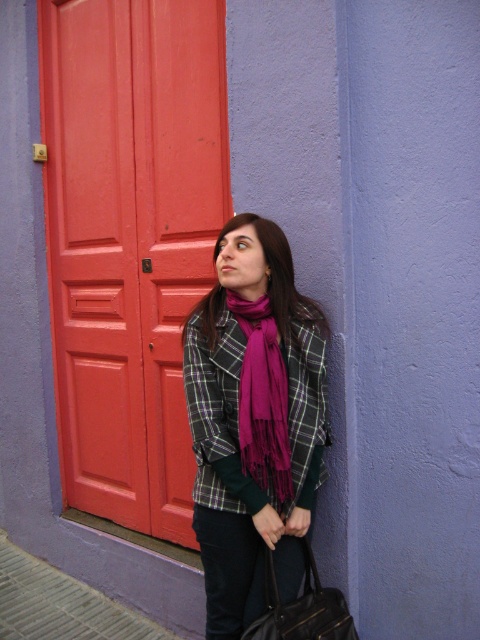
Question: Which object appears closest to the camera in this image?

Choices:
 (A) matte red door at left
 (B) plaid fabric at center

Answer: (B)

Question: Does purple fringed scarf at center have a lesser width compared to leather handbag at lower center?

Choices:
 (A) no
 (B) yes

Answer: (B)

Question: Which is nearer to the purple fringed scarf at center?

Choices:
 (A) leather handbag at lower center
 (B) matte red door at left
 (C) plaid woolen jacket at center
 (D) plaid fabric at center

Answer: (D)

Question: Is plaid woolen jacket at center behind purple fringed scarf at center?

Choices:
 (A) yes
 (B) no

Answer: (A)

Question: Does plaid woolen jacket at center come behind plaid fabric at center?

Choices:
 (A) no
 (B) yes

Answer: (A)

Question: Which of these objects is positioned farthest from the leather handbag at lower center?

Choices:
 (A) purple fringed scarf at center
 (B) plaid woolen jacket at center
 (C) matte red door at left
 (D) plaid fabric at center

Answer: (C)